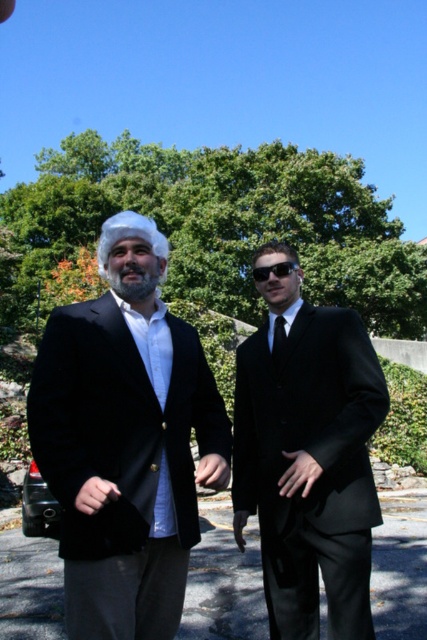
Question: Which of the following is the closest to the observer?

Choices:
 (A) pyautogui.click(x=283, y=506)
 (B) pyautogui.click(x=298, y=266)
 (C) pyautogui.click(x=283, y=337)

Answer: (A)

Question: Which point appears closest to the camera in this image?

Choices:
 (A) (336, 426)
 (B) (277, 360)
 (C) (58, 465)
 (D) (283, 268)

Answer: (C)

Question: Is black plastic sunglasses at center thinner than black silk tie at center?

Choices:
 (A) no
 (B) yes

Answer: (A)

Question: Is black velvet suit at left thinner than black silk tie at center?

Choices:
 (A) no
 (B) yes

Answer: (A)

Question: Among these points, which one is farthest from the camera?

Choices:
 (A) (110, 502)
 (B) (187, 433)
 (C) (254, 273)

Answer: (C)

Question: Does velvet black suit at center come in front of black plastic sunglasses at center?

Choices:
 (A) yes
 (B) no

Answer: (A)